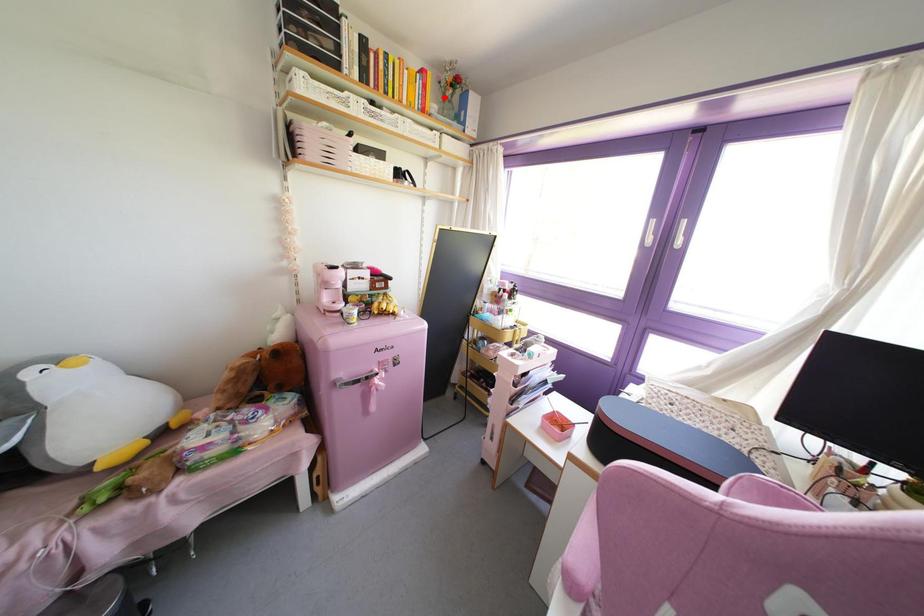
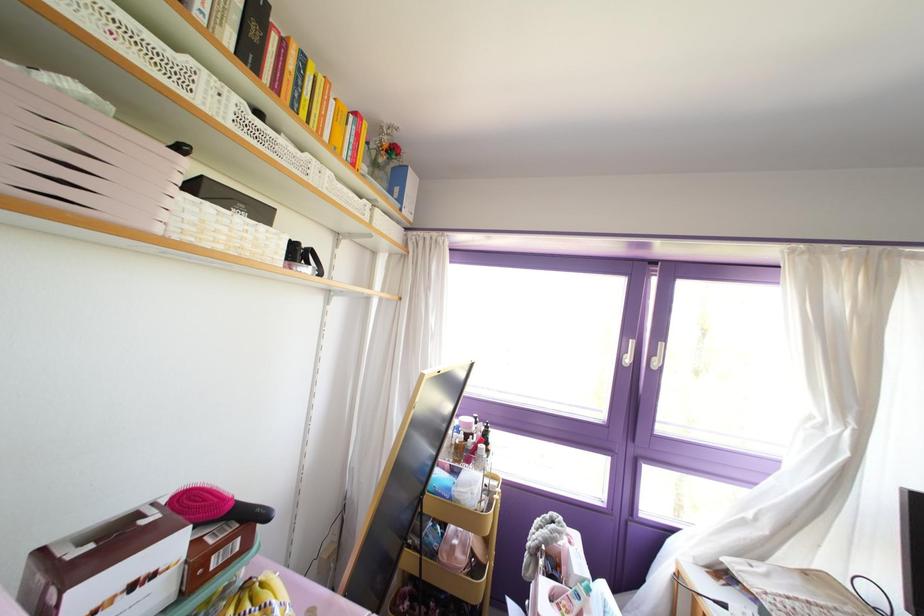
Where in the second image is the point corresponding to the highlighted location from the first image?

(372, 163)